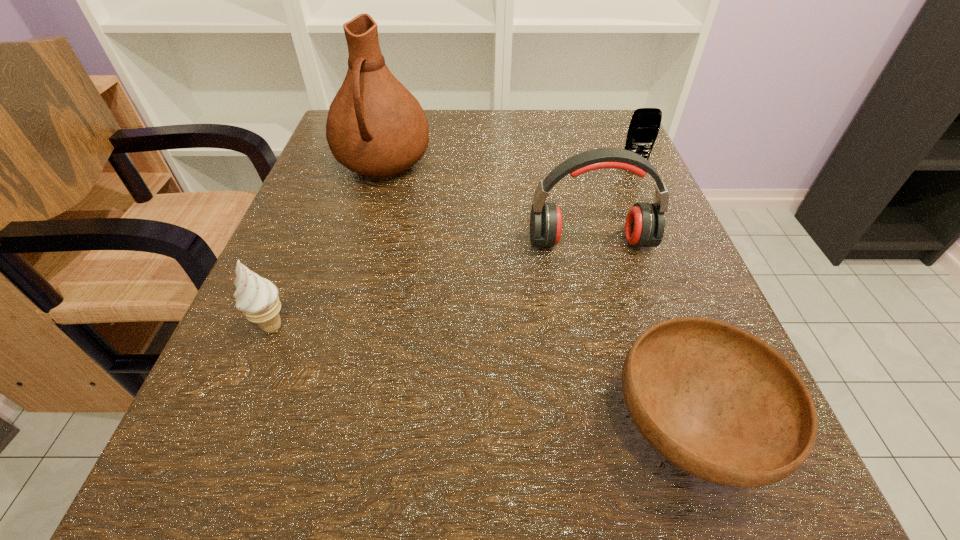
Identify the location of object located at the far left corner. (375, 127).

Identify the location of object present at the far right corner. This screenshot has height=540, width=960. (644, 126).

This screenshot has height=540, width=960. What are the coordinates of `object located at the near right corner` in the screenshot? It's located at (716, 401).

Locate an element on the screen. This screenshot has width=960, height=540. free region at the far edge of the desktop is located at coordinates (514, 157).

Find the location of a particular element. free space at the near edge of the desktop is located at coordinates (453, 467).

This screenshot has width=960, height=540. Find the location of `free space at the left edge of the desktop`. free space at the left edge of the desktop is located at coordinates (288, 296).

The image size is (960, 540). I want to click on free spot at the near left corner of the desktop, so click(316, 487).

The height and width of the screenshot is (540, 960). I want to click on blank space at the far right corner of the desktop, so [x=614, y=127].

Identify the location of vacant area that lies between the fourth shortest object and the tallest object. This screenshot has height=540, width=960. coord(487,203).

The height and width of the screenshot is (540, 960). Find the location of `vacant space in between the cellular telephone and the shortest object`. vacant space in between the cellular telephone and the shortest object is located at coordinates (660, 299).